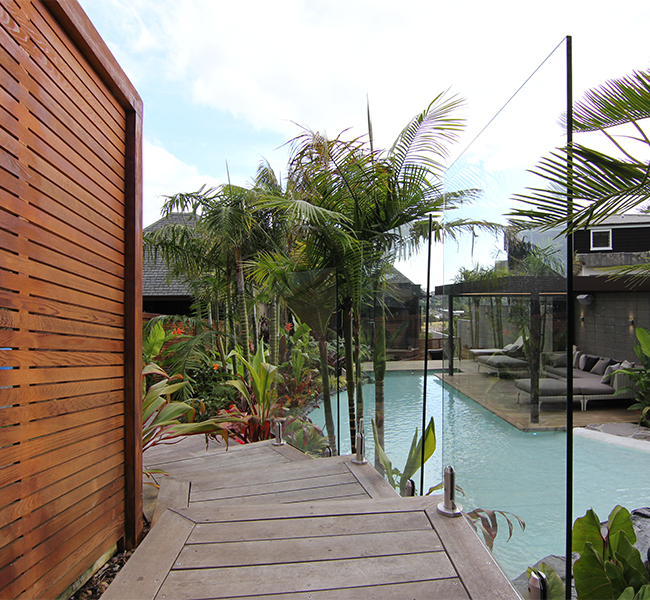
I want to click on ottoman, so click(x=496, y=366).